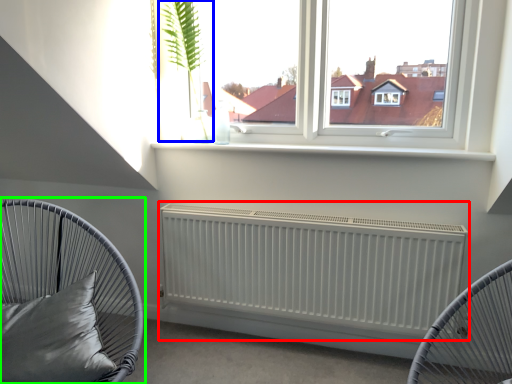
Question: Based on their relative distances, which object is farther from radiator (highlighted by a red box)? Choose from plant (highlighted by a blue box) and furniture (highlighted by a green box).

Choices:
 (A) plant
 (B) furniture

Answer: (A)